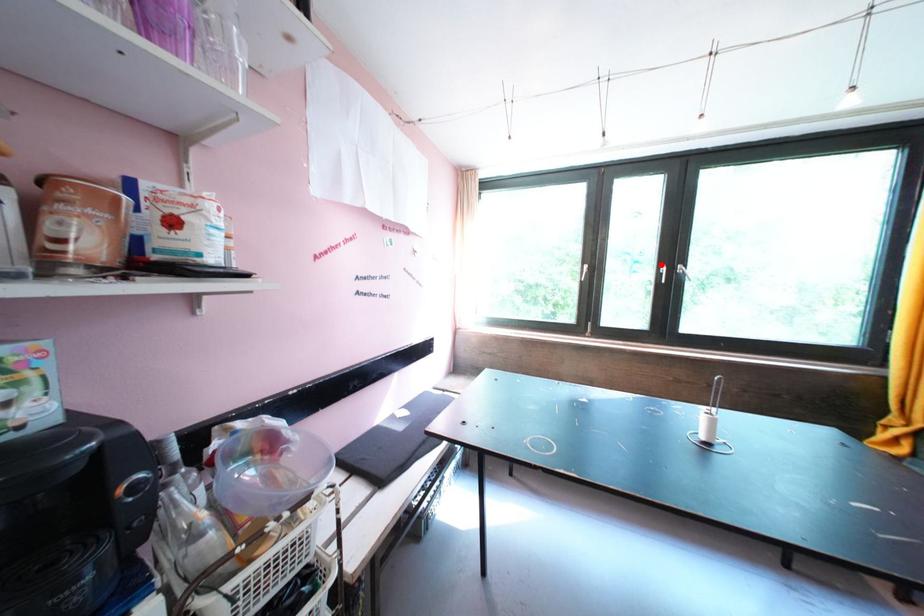
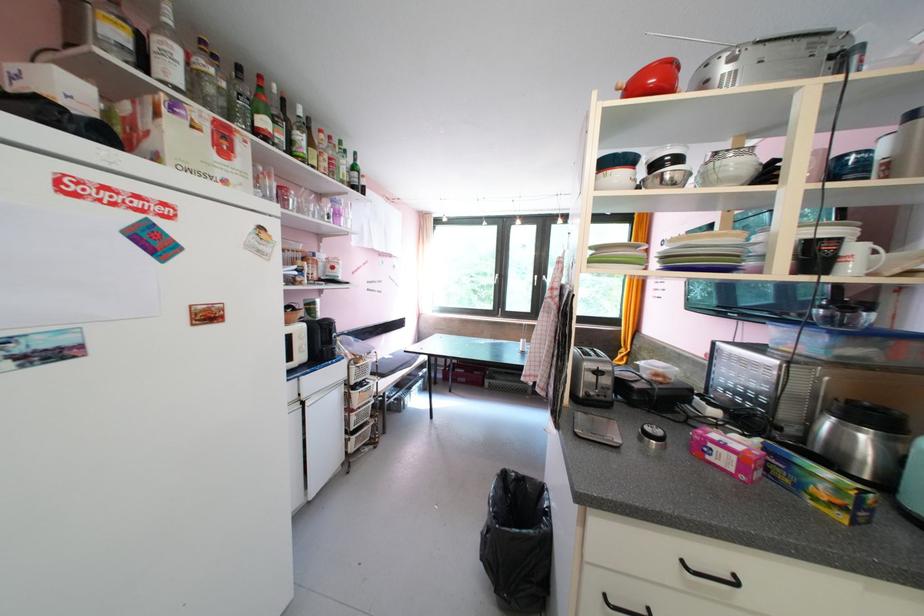
Question: I am providing you with two images of the same scene from different viewpoints. A red point is marked on the first image. Can you still see the location of the red point in image 2?

Choices:
 (A) Yes
 (B) No

Answer: (B)